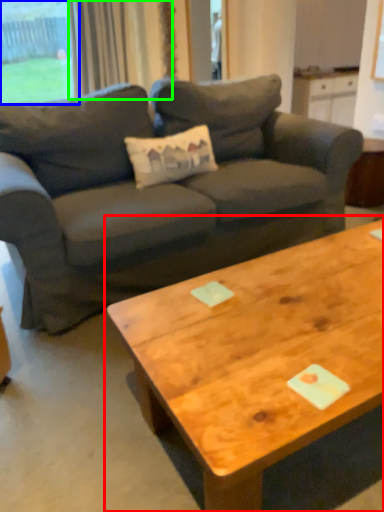
Question: Based on their relative distances, which object is nearer to coffee table (highlighted by a red box)? Choose from window (highlighted by a blue box) and curtain (highlighted by a green box).

Choices:
 (A) window
 (B) curtain

Answer: (B)